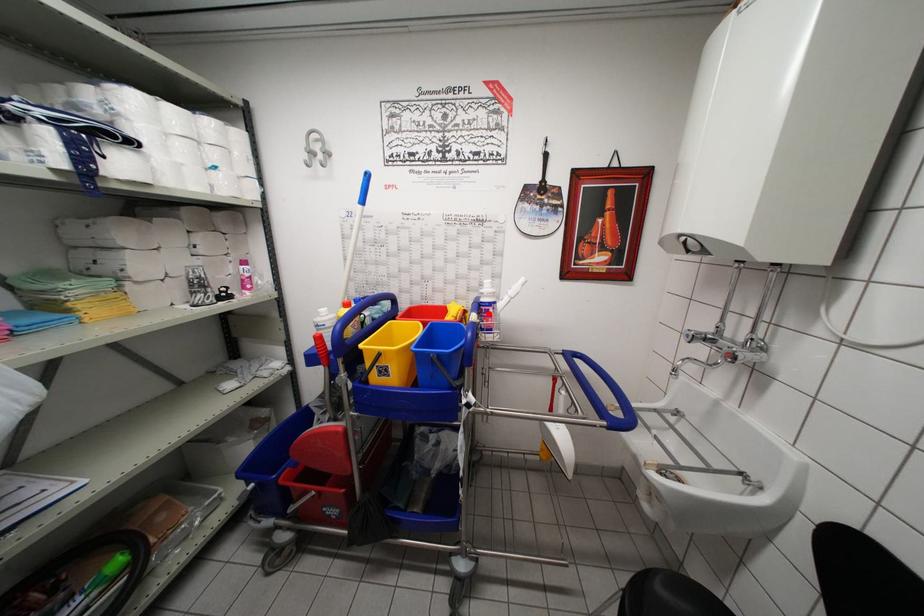
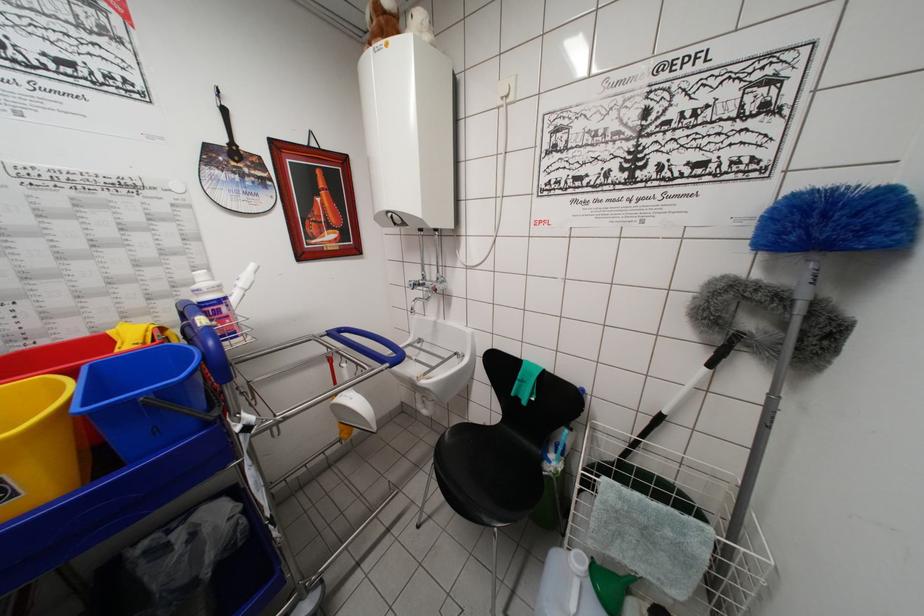
Locate, in the second image, the point that corresponds to the highlighted location in the first image.

(215, 315)